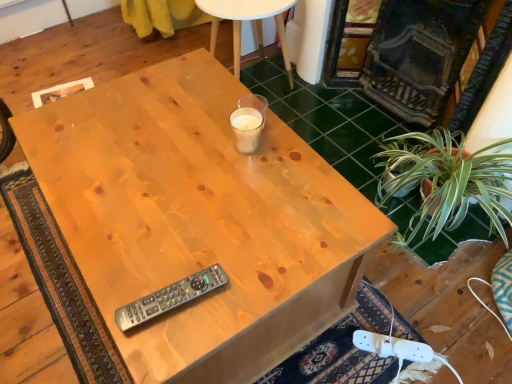
How much space does translucent glass candle at center, the 2th coffee cup when ordered from top to bottom, occupy vertically?

4.03 inches.

Measure the distance between point [248,120] and camera.

The depth of point [248,120] is 1.12 meters.

Locate an element on the screen. The image size is (512, 384). clear glass candle at upper center is located at coordinates tap(250, 20).

How different are the orientations of white paper cup at center, the 2th coffee cup in the bottom-to-top sequence, and natural wood desk at center in degrees?

There is a 92.7-degree angle between the facing directions of white paper cup at center, the 2th coffee cup in the bottom-to-top sequence, and natural wood desk at center.

Which of these two, white paper cup at center, the 2th coffee cup in the bottom-to-top sequence, or natural wood desk at center, stands taller?

Standing taller between the two is natural wood desk at center.

From a real-world perspective, is white paper cup at center, the 2th coffee cup in the bottom-to-top sequence, positioned under natural wood desk at center based on gravity?

Incorrect, from a real-world perspective, white paper cup at center, the 2th coffee cup in the bottom-to-top sequence, is higher than natural wood desk at center.

Based on their positions, is white paper cup at center, positioned as the first coffee cup in top-to-bottom order, located to the left or right of natural wood desk at center?

Clearly, white paper cup at center, positioned as the first coffee cup in top-to-bottom order, is on the right of natural wood desk at center in the image.

From a real-world perspective, which object rests below the other?

clear glass candle at upper center.

Which of these two, white paper cup at center, positioned as the first coffee cup in top-to-bottom order, or clear glass candle at upper center, is thinner?

Thinner between the two is white paper cup at center, positioned as the first coffee cup in top-to-bottom order.

Is white paper cup at center, positioned as the first coffee cup in top-to-bottom order, surrounding clear glass candle at upper center?

No, clear glass candle at upper center is not inside white paper cup at center, positioned as the first coffee cup in top-to-bottom order.

Which object is further away from the camera, white paper cup at center, positioned as the first coffee cup in top-to-bottom order, or clear glass candle at upper center?

clear glass candle at upper center.

The width and height of the screenshot is (512, 384). I want to click on the 2nd coffee cup above the natural wood desk at center (from a real-world perspective), so click(x=246, y=129).

How much distance is there between translucent glass candle at center, marked as the first coffee cup in a bottom-to-top arrangement, and natural wood desk at center?

translucent glass candle at center, marked as the first coffee cup in a bottom-to-top arrangement, is 13.81 inches away from natural wood desk at center.

From the image's perspective, between translucent glass candle at center, marked as the first coffee cup in a bottom-to-top arrangement, and natural wood desk at center, who is located below?

natural wood desk at center.

Considering the positions of point (261, 122) and point (329, 202), is point (261, 122) closer or farther from the camera than point (329, 202)?

Point (261, 122).

From the image's perspective, which one is positioned lower, translucent glass candle at center, marked as the first coffee cup in a bottom-to-top arrangement, or gray plastic remote at center?

gray plastic remote at center is shown below in the image.

Considering the sizes of objects translucent glass candle at center, marked as the first coffee cup in a bottom-to-top arrangement, and gray plastic remote at center in the image provided, who is wider, translucent glass candle at center, marked as the first coffee cup in a bottom-to-top arrangement, or gray plastic remote at center?

gray plastic remote at center.

Is translucent glass candle at center, marked as the first coffee cup in a bottom-to-top arrangement, aimed at gray plastic remote at center?

No, translucent glass candle at center, marked as the first coffee cup in a bottom-to-top arrangement, is not turned towards gray plastic remote at center.

From a real-world perspective, between translucent glass candle at center, the 2th coffee cup when ordered from top to bottom, and gray plastic remote at center, who is vertically lower?

gray plastic remote at center is physically lower.

Is there a large distance between gray plastic remote at center and natural wood desk at center?

Actually, gray plastic remote at center and natural wood desk at center are a little close together.

Which is in front, point (160, 295) or point (249, 253)?

The point (160, 295) is closer.

Considering the sizes of gray plastic remote at center and natural wood desk at center in the image, is gray plastic remote at center bigger or smaller than natural wood desk at center?

In the image, gray plastic remote at center appears to be smaller than natural wood desk at center.

Considering the points (211, 52) and (257, 108), which point is behind, point (211, 52) or point (257, 108)?

The point (211, 52) is farther.

Is clear glass candle at upper center surrounding white paper cup at center, the 2th coffee cup in the bottom-to-top sequence?

No, white paper cup at center, the 2th coffee cup in the bottom-to-top sequence, is not inside clear glass candle at upper center.

Which object is further away from the camera taking this photo, clear glass candle at upper center or white paper cup at center, positioned as the first coffee cup in top-to-bottom order?

clear glass candle at upper center.

Is clear glass candle at upper center next to white paper cup at center, positioned as the first coffee cup in top-to-bottom order, and touching it?

No, clear glass candle at upper center is not in contact with white paper cup at center, positioned as the first coffee cup in top-to-bottom order.

Is point (205, 283) closer to camera compared to point (233, 125)?

Yes, it is.

Is gray plastic remote at center in contact with translucent glass candle at center, the 2th coffee cup when ordered from top to bottom?

No, gray plastic remote at center is not beside translucent glass candle at center, the 2th coffee cup when ordered from top to bottom.

From the image's perspective, is gray plastic remote at center beneath translucent glass candle at center, the 2th coffee cup when ordered from top to bottom?

Yes, from the image's perspective, gray plastic remote at center is beneath translucent glass candle at center, the 2th coffee cup when ordered from top to bottom.

From the image's perspective, count 2nd coffee cups upward from the natural wood desk at center and point to it. Please provide its 2D coordinates.

[(254, 104)]

Image resolution: width=512 pixels, height=384 pixels. Identify the location of coffee cup that is the 1st one when counting forward from the clear glass candle at upper center. (254, 104).

Estimate the real-world distances between objects in this image. Which object is closer to clear glass candle at upper center, translucent glass candle at center, marked as the first coffee cup in a bottom-to-top arrangement, or gray plastic remote at center?

translucent glass candle at center, marked as the first coffee cup in a bottom-to-top arrangement, is positioned closer to the anchor clear glass candle at upper center.

Based on their spatial positions, is translucent glass candle at center, the 2th coffee cup when ordered from top to bottom, or clear glass candle at upper center closer to gray plastic remote at center?

Among the two, translucent glass candle at center, the 2th coffee cup when ordered from top to bottom, is located nearer to gray plastic remote at center.

Based on their spatial positions, is natural wood desk at center or clear glass candle at upper center closer to gray plastic remote at center?

natural wood desk at center lies closer to gray plastic remote at center than the other object.

Which object lies further to the anchor point white paper cup at center, the 2th coffee cup in the bottom-to-top sequence, gray plastic remote at center or clear glass candle at upper center?

Among the two, clear glass candle at upper center is located further to white paper cup at center, the 2th coffee cup in the bottom-to-top sequence.

Which object lies further to the anchor point clear glass candle at upper center, gray plastic remote at center or natural wood desk at center?

Based on the image, gray plastic remote at center appears to be further to clear glass candle at upper center.

Which object lies nearer to the anchor point gray plastic remote at center, white paper cup at center, positioned as the first coffee cup in top-to-bottom order, or natural wood desk at center?

natural wood desk at center is closer to gray plastic remote at center.

Considering their positions, is white paper cup at center, the 2th coffee cup in the bottom-to-top sequence, positioned closer to clear glass candle at upper center than translucent glass candle at center, the 2th coffee cup when ordered from top to bottom?

The object closer to clear glass candle at upper center is white paper cup at center, the 2th coffee cup in the bottom-to-top sequence.

When comparing their distances from gray plastic remote at center, does clear glass candle at upper center or natural wood desk at center seem closer?

natural wood desk at center is positioned closer to the anchor gray plastic remote at center.

Find the location of a particular element. coffee cup between white paper cup at center, the 2th coffee cup in the bottom-to-top sequence, and gray plastic remote at center from top to bottom is located at coordinates (246, 129).

At what (x,y) coordinates should I click in order to perform the action: click on desk between clear glass candle at upper center and gray plastic remote at center vertically. Please return your answer as a coordinate pair (x, y). The width and height of the screenshot is (512, 384). Looking at the image, I should click on (196, 221).

The width and height of the screenshot is (512, 384). Identify the location of coffee cup between clear glass candle at upper center and translucent glass candle at center, the 2th coffee cup when ordered from top to bottom, in the up-down direction. (254, 104).

You are a GUI agent. You are given a task and a screenshot of the screen. Output one action in this format:
    pyautogui.click(x=<x>, y=<y>)
    Task: Click on the desk between translucent glass candle at center, the 2th coffee cup when ordered from top to bottom, and gray plastic remote at center, in the vertical direction
    The height and width of the screenshot is (384, 512).
    Given the screenshot: What is the action you would take?
    pyautogui.click(x=196, y=221)